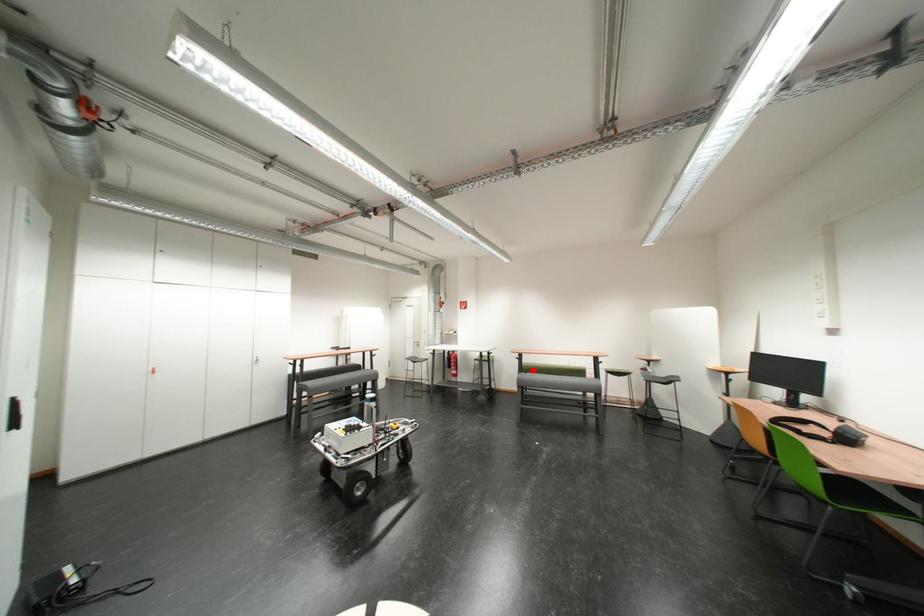
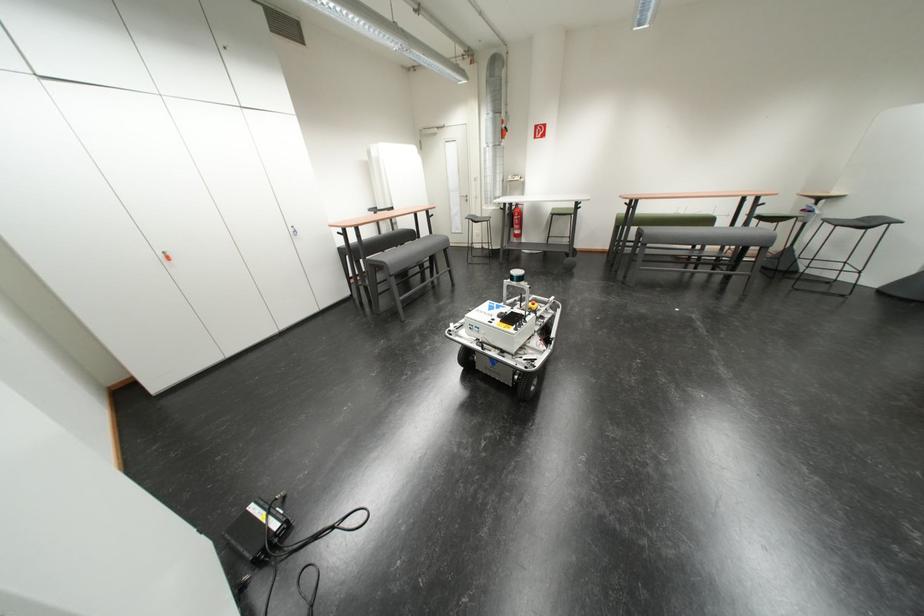
Question: I am providing you with two images of the same scene from different viewpoints. A red point is marked on the first image. Is the red point's position out of view in image 2?

Choices:
 (A) Yes
 (B) No

Answer: (B)